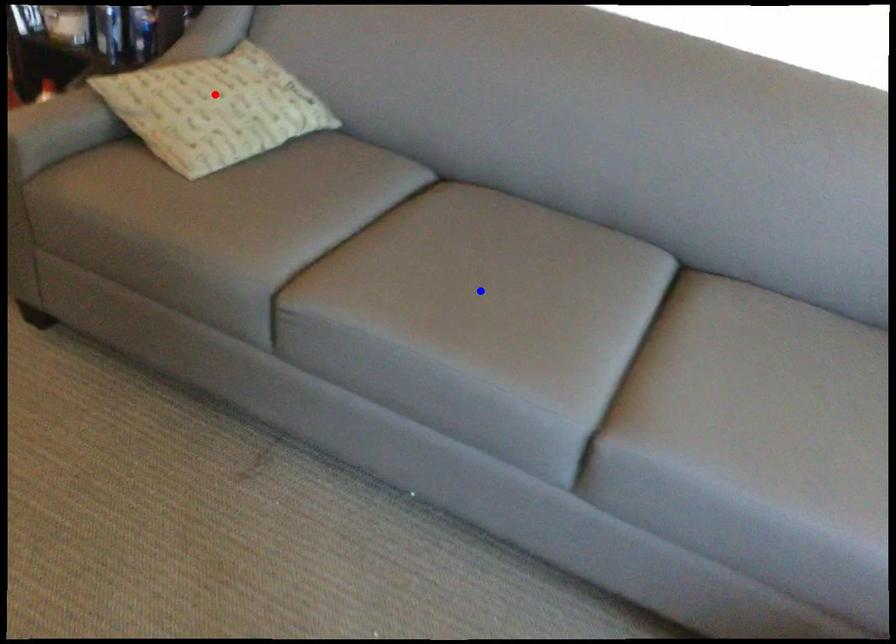
Question: Two points are marked on the image. Which point is closer to the camera?

Choices:
 (A) Blue point is closer.
 (B) Red point is closer.

Answer: (A)